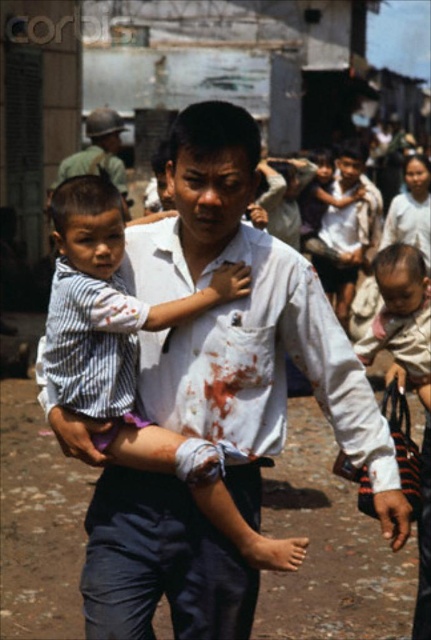
Is the position of striped cotton shirt at center less distant than that of metallic helmet at upper left?

Yes, it is.

Between striped cotton shirt at center and metallic helmet at upper left, which one appears on the left side from the viewer's perspective?

metallic helmet at upper left is more to the left.

Which is behind, point (274, 544) or point (55, 180)?

The point (55, 180) is behind.

Where is `striped cotton shirt at center`? The image size is (431, 640). striped cotton shirt at center is located at coordinates (246, 531).